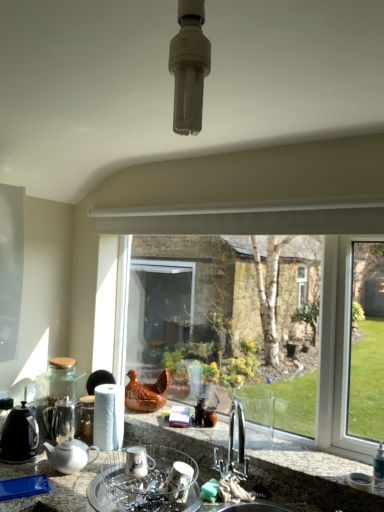
Question: Is white ceramic mug at lower center, which ranks as the 2th appliance in front-to-back order, in front of or behind clear glass window at center in the image?

Choices:
 (A) front
 (B) behind

Answer: (B)

Question: From the image's perspective, is white ceramic mug at lower center, the first appliance when ordered from back to front, above or below clear glass window at center?

Choices:
 (A) above
 (B) below

Answer: (B)

Question: Which of these objects is positioned farthest from the clear glass window at center?

Choices:
 (A) shiny metallic teapot at left
 (B) metallic sink at lower center
 (C) white ceramic mug at lower center, the first appliance when ordered from back to front
 (D) porcelain dish rack at center, the 2th appliance viewed from the back
 (E) white glossy teapot at lower left, the second kitchen appliance positioned from the left

Answer: (E)

Question: Estimate the real-world distances between objects in this image. Which object is closer to the granite countertop at lower center?

Choices:
 (A) shiny metallic teapot at left
 (B) porcelain dish rack at center, the 2th appliance viewed from the back
 (C) black matte kettle at left, which is the 1th kitchen appliance from left to right
 (D) white glossy teapot at lower left, the second kitchen appliance positioned from the left
 (E) metallic sink at lower center

Answer: (E)